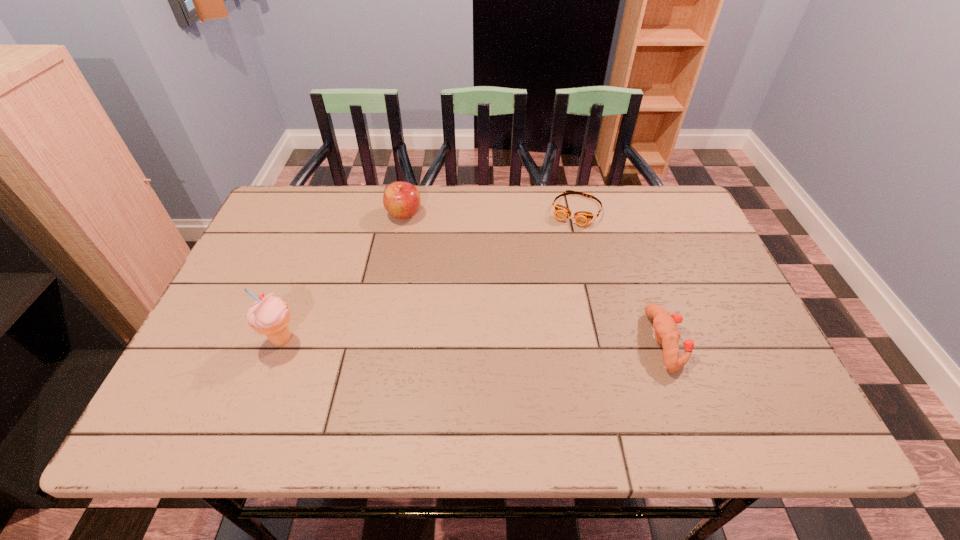
You are a GUI agent. You are given a task and a screenshot of the screen. Output one action in this format:
    pyautogui.click(x=<x>, y=<y>)
    Task: Click on the free space between the shortest object and the third tallest object
    Image resolution: width=960 pixels, height=540 pixels.
    Given the screenshot: What is the action you would take?
    pyautogui.click(x=621, y=276)

Locate an element on the screen. The image size is (960, 540). vacant space in between the third shortest object and the shortest object is located at coordinates (491, 212).

Locate an element on the screen. This screenshot has height=540, width=960. vacant area that lies between the leftmost object and the shortest object is located at coordinates (429, 275).

Where is `free space between the shortest object and the second object from left to right`? The width and height of the screenshot is (960, 540). free space between the shortest object and the second object from left to right is located at coordinates (491, 212).

Locate an element on the screen. vacant point located between the icecream and the second tallest object is located at coordinates click(343, 277).

Find the location of `vacant region between the second tallest object and the icecream`. vacant region between the second tallest object and the icecream is located at coordinates (343, 277).

Locate an element on the screen. The height and width of the screenshot is (540, 960). vacant area between the third object from right to left and the goggles is located at coordinates (491, 212).

Select which object is the closest to the goggles. Please provide its 2D coordinates. Your answer should be formatted as a tuple, i.e. [(x, y)], where the tuple contains the x and y coordinates of a point satisfying the conditions above.

[(664, 323)]

Choose which object is the second nearest neighbor to the rightmost object. Please provide its 2D coordinates. Your answer should be formatted as a tuple, i.e. [(x, y)], where the tuple contains the x and y coordinates of a point satisfying the conditions above.

[(402, 200)]

At what (x,y) coordinates should I click in order to perform the action: click on free location that satisfies the following two spatial constraints: 1. on the front side of the second shortest object; 2. with the gloves of the leftmost object facing forward. Please return your answer as a coordinate pair (x, y). This screenshot has height=540, width=960. Looking at the image, I should click on (281, 342).